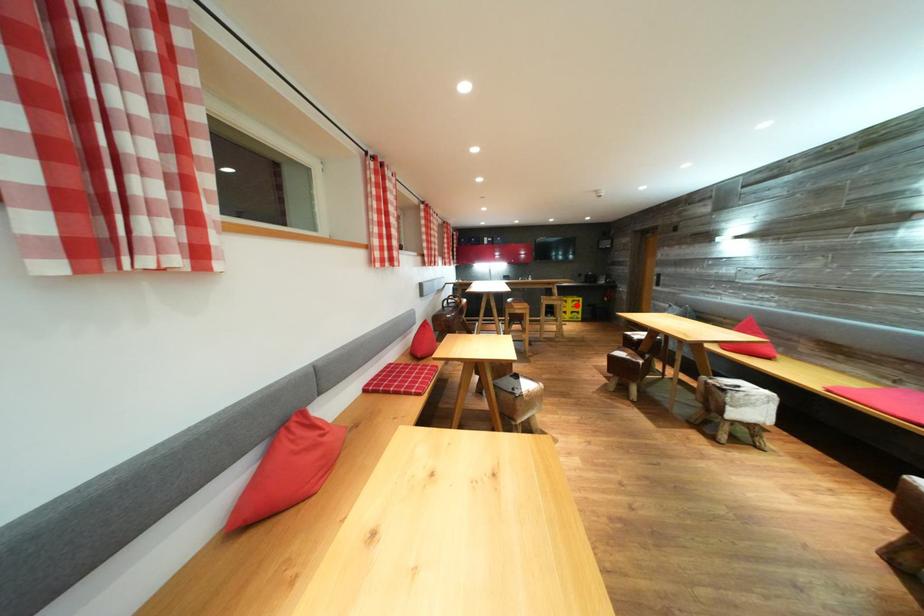
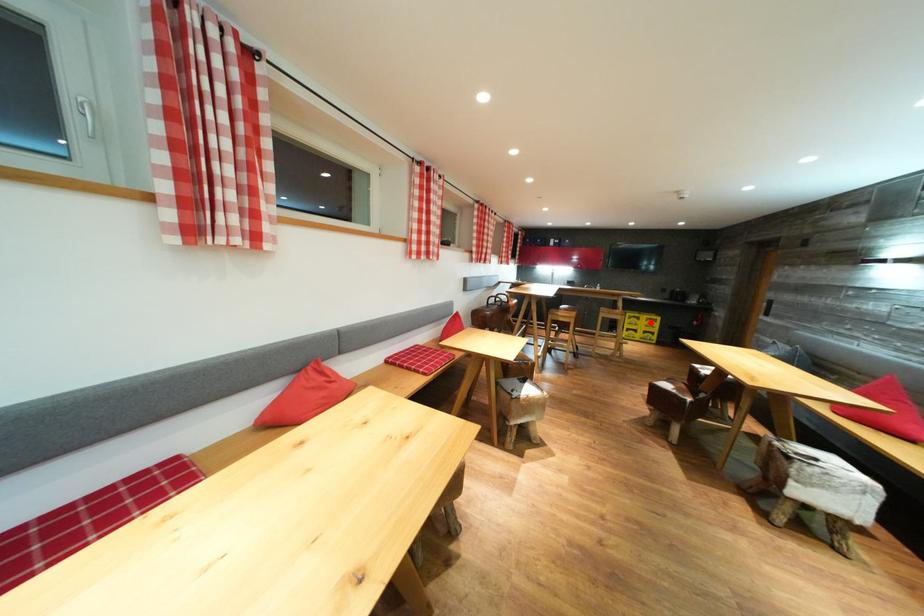
I am providing you with two images of the same scene from different viewpoints. A red point is marked on the first image and another point is marked on the second image. Do the highlighted points in image1 and image2 indicate the same real-world spot?

Yes